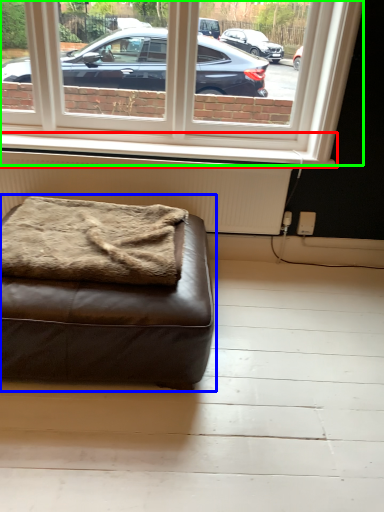
Question: Considering the real-world distances, which object is closest to window sill (highlighted by a red box)? studio couch (highlighted by a blue box) or window (highlighted by a green box).

Choices:
 (A) studio couch
 (B) window

Answer: (B)